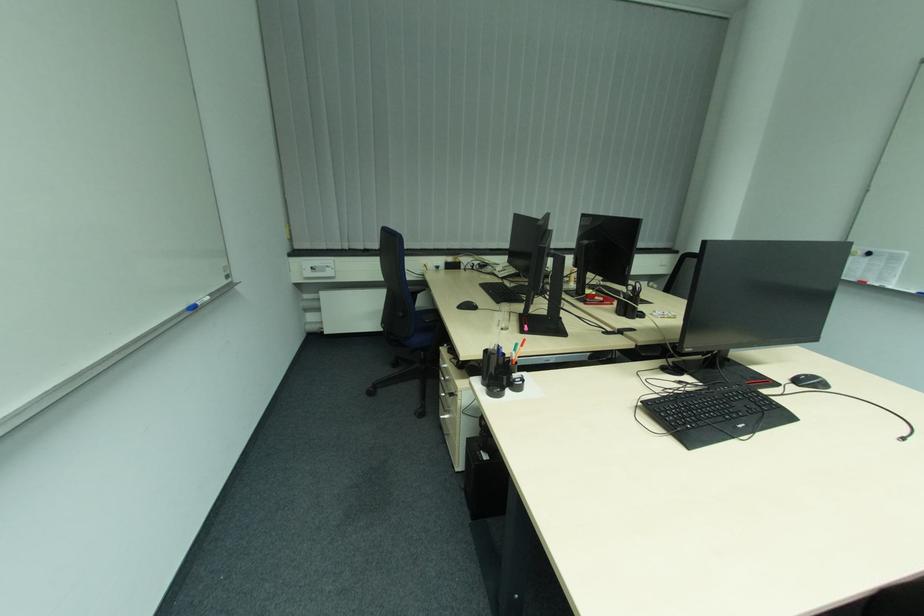
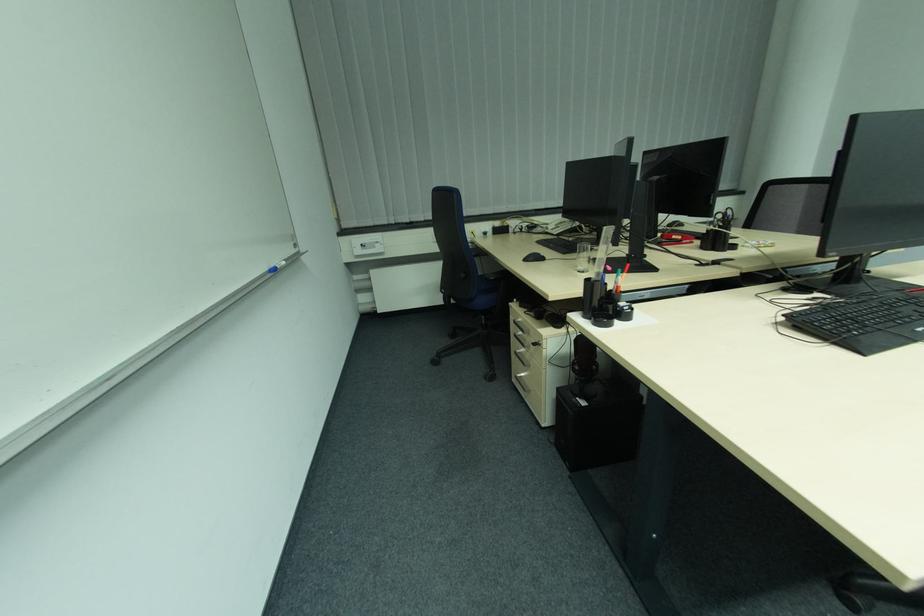
Question: The images are taken continuously from a first-person perspective. In which direction are you moving?

Choices:
 (A) Left
 (B) Right
 (C) Forward
 (D) Backward

Answer: (A)